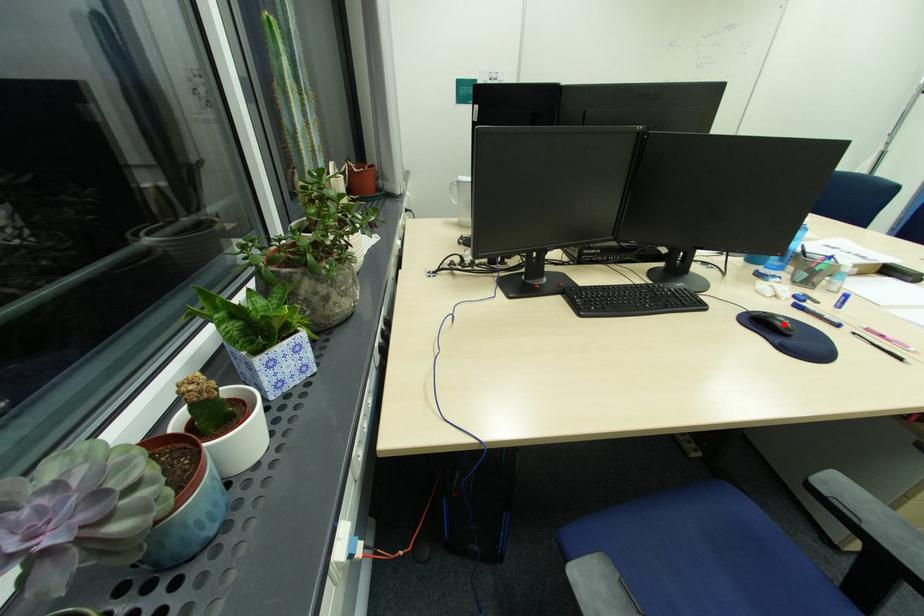
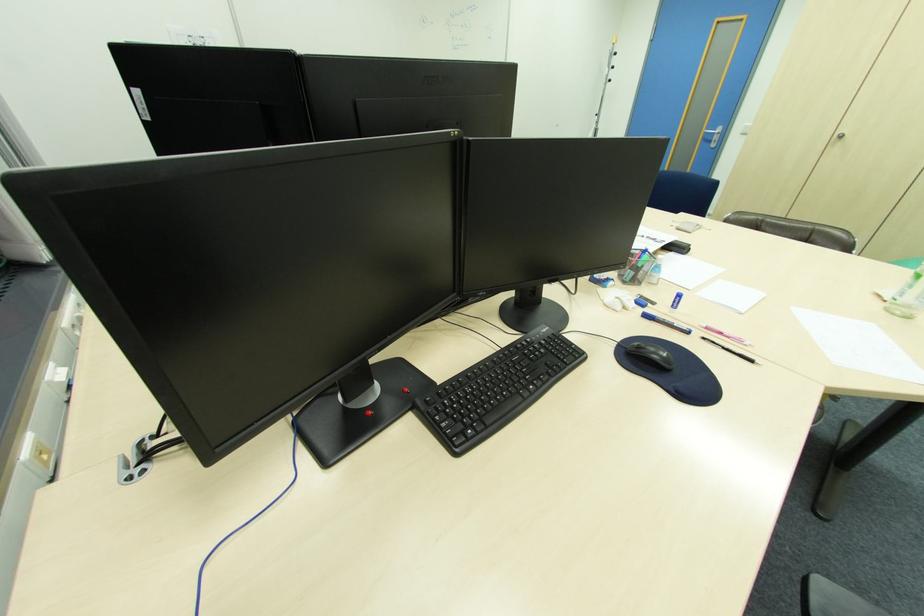
Question: I am providing you with two images of the same scene from different viewpoints. A red point is marked on the first image. Can you still see the location of the red point in image 2?

Choices:
 (A) Yes
 (B) No

Answer: (A)